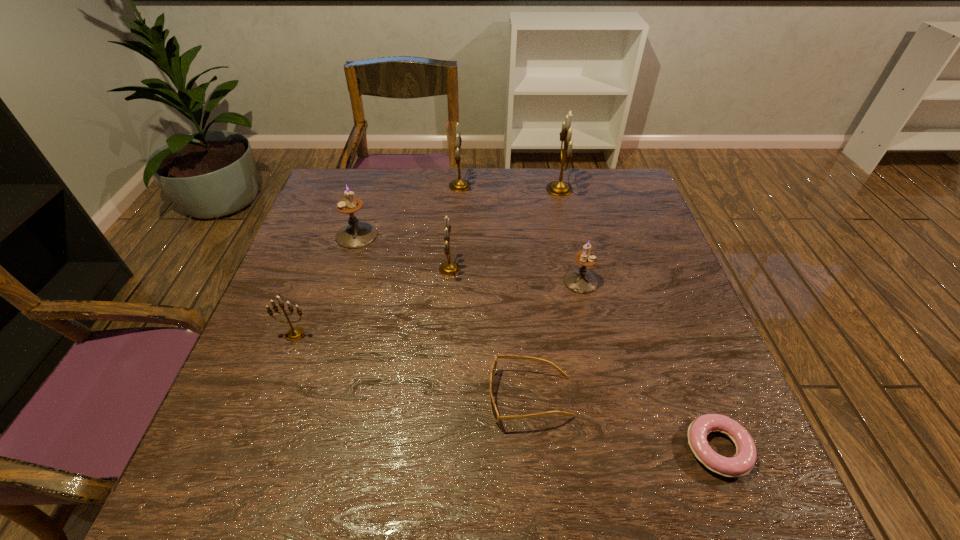
This screenshot has width=960, height=540. What are the coordinates of `free location at the right edge of the desktop` in the screenshot? It's located at (675, 426).

Where is `blank region between the smaller purple candle holder and the doughnut`? This screenshot has height=540, width=960. blank region between the smaller purple candle holder and the doughnut is located at coordinates pos(649,365).

Image resolution: width=960 pixels, height=540 pixels. What are the coordinates of `vacant space in between the nearest candelabrum and the bigger purple candle holder` in the screenshot? It's located at (325, 285).

You are a GUI agent. You are given a task and a screenshot of the screen. Output one action in this format:
    pyautogui.click(x=<x>, y=<y>)
    Task: Click on the vacant region between the second biggest gold candelabrum and the nearest gold candelabrum
    Image resolution: width=960 pixels, height=540 pixels.
    Given the screenshot: What is the action you would take?
    pyautogui.click(x=377, y=260)

Where is `vacant space that's between the rightmost object and the sunglasses`? The width and height of the screenshot is (960, 540). vacant space that's between the rightmost object and the sunglasses is located at coordinates (624, 423).

This screenshot has width=960, height=540. What are the coordinates of `free space between the sixth nearest object and the nearest candelabrum` in the screenshot? It's located at (325, 285).

This screenshot has height=540, width=960. In order to click on vacant space that is in between the fifth object from left to right and the tallest object in this screenshot , I will do `click(544, 293)`.

Locate an element on the screen. This screenshot has height=540, width=960. empty location between the rightmost object and the fifth shortest candelabrum is located at coordinates (588, 317).

Find the location of `unoccupied area between the bigger purple candle holder and the seventh shortest object`. unoccupied area between the bigger purple candle holder and the seventh shortest object is located at coordinates (408, 211).

Find the location of `vacant region between the right purple candle holder and the seventh shortest object`. vacant region between the right purple candle holder and the seventh shortest object is located at coordinates (520, 233).